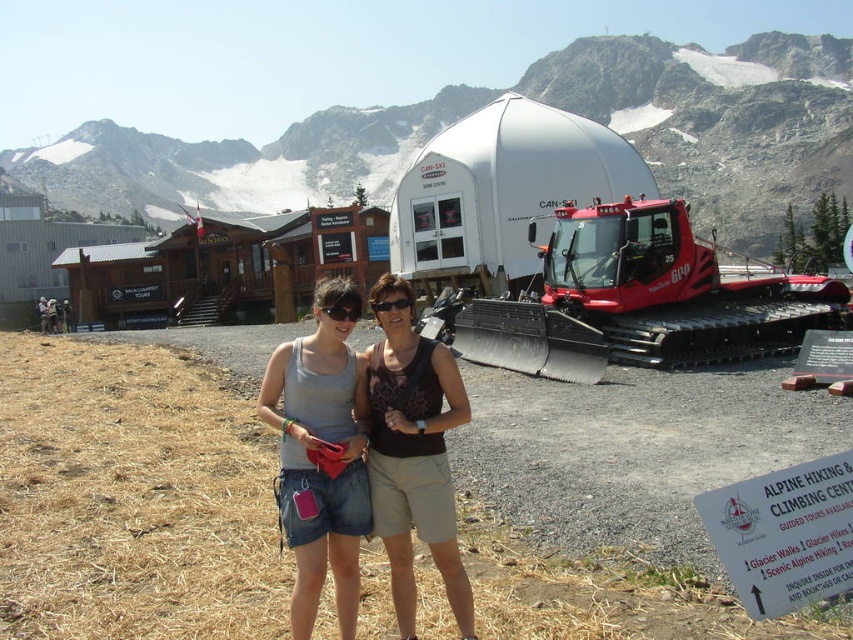
Question: Which object appears farthest from the camera in this image?

Choices:
 (A) denim shorts at center
 (B) matte gray tank top at center
 (C) black plastic goggles at center
 (D) red rubber tractor at right

Answer: (B)

Question: Observing the image, what is the correct spatial positioning of white matte dome at upper center in reference to black matte goggles at center?

Choices:
 (A) left
 (B) right

Answer: (A)

Question: Is red rubber tractor at right bigger than denim shorts at center?

Choices:
 (A) yes
 (B) no

Answer: (B)

Question: Which point appears farthest from the camera in this image?

Choices:
 (A) (341, 180)
 (B) (654, 252)

Answer: (A)

Question: Is red rubber tractor at right positioned in front of denim shorts at center?

Choices:
 (A) no
 (B) yes

Answer: (A)

Question: Which of the following is the closest to the observer?

Choices:
 (A) coord(463,324)
 (B) coord(340,317)
 (C) coord(381,300)
 (D) coord(51,314)

Answer: (B)